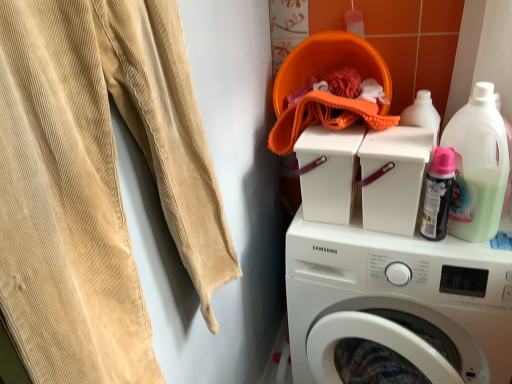
Question: Does white plastic container at center have a greater width compared to translucent plastic detergent at upper right?

Choices:
 (A) yes
 (B) no

Answer: (B)

Question: Would you say white plastic container at center is outside translucent plastic detergent at upper right?

Choices:
 (A) no
 (B) yes

Answer: (B)

Question: Considering the relative positions of white plastic container at center and translucent plastic detergent at upper right in the image provided, is white plastic container at center to the right of translucent plastic detergent at upper right from the viewer's perspective?

Choices:
 (A) yes
 (B) no

Answer: (B)

Question: Is white plastic container at center touching translucent plastic detergent at upper right?

Choices:
 (A) no
 (B) yes

Answer: (A)

Question: Does white plastic container at center turn towards translucent plastic detergent at upper right?

Choices:
 (A) yes
 (B) no

Answer: (B)

Question: Based on their sizes in the image, would you say white plastic washing machine at center, the 1th washing machine positioned from the top, is bigger or smaller than translucent plastic detergent at upper right?

Choices:
 (A) small
 (B) big

Answer: (A)

Question: Is white plastic washing machine at center, acting as the 2th washing machine starting from the bottom, spatially inside translucent plastic detergent at upper right, or outside of it?

Choices:
 (A) inside
 (B) outside

Answer: (B)

Question: Based on their positions, is white plastic washing machine at center, the 1th washing machine positioned from the top, located to the left or right of translucent plastic detergent at upper right?

Choices:
 (A) right
 (B) left

Answer: (B)

Question: Considering the positions of point (358, 144) and point (470, 158), is point (358, 144) closer or farther from the camera than point (470, 158)?

Choices:
 (A) farther
 (B) closer

Answer: (A)

Question: From a real-world perspective, is white plastic container at center physically located above or below matte black spray can at upper right?

Choices:
 (A) above
 (B) below

Answer: (B)

Question: Is white plastic container at center to the left or to the right of matte black spray can at upper right in the image?

Choices:
 (A) right
 (B) left

Answer: (B)

Question: From their relative heights in the image, would you say white plastic container at center is taller or shorter than matte black spray can at upper right?

Choices:
 (A) short
 (B) tall

Answer: (A)

Question: Is white plastic container at center bigger or smaller than matte black spray can at upper right?

Choices:
 (A) small
 (B) big

Answer: (B)

Question: In terms of width, does beige corduroy sweat pants at left look wider or thinner when compared to matte black spray can at upper right?

Choices:
 (A) thin
 (B) wide

Answer: (B)

Question: Considering the positions of beige corduroy sweat pants at left and matte black spray can at upper right in the image, is beige corduroy sweat pants at left taller or shorter than matte black spray can at upper right?

Choices:
 (A) tall
 (B) short

Answer: (A)